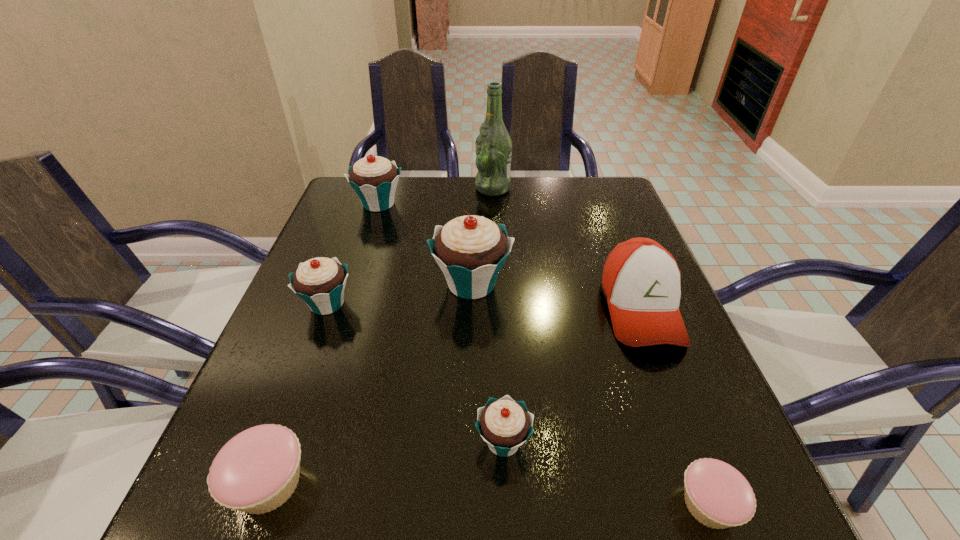
Locate an element on the screen. free spot between the third shortest cupcake and the orange baseball cap is located at coordinates (572, 375).

In order to click on vacant space that's between the nearest teal cupcake and the green beer bottle in this screenshot , I will do `click(498, 315)`.

This screenshot has width=960, height=540. In order to click on vacant area that lies between the seventh tallest object and the rightmost cupcake in this screenshot , I will do `click(489, 494)`.

Where is `empty location between the fifth tallest cupcake and the seventh shortest object`? empty location between the fifth tallest cupcake and the seventh shortest object is located at coordinates (370, 383).

Find the location of a particular element. This screenshot has width=960, height=540. vacant space that's between the fifth tallest cupcake and the fifth shortest cupcake is located at coordinates (324, 343).

Image resolution: width=960 pixels, height=540 pixels. In order to click on empty space between the sixth tallest object and the second tallest object in this screenshot , I will do `click(488, 363)`.

This screenshot has height=540, width=960. Identify the location of object identified as the second closest to the tallest cupcake. (641, 280).

Point out which object is positioned as the seventh nearest to the tallest cupcake. Please provide its 2D coordinates. Your answer should be formatted as a tuple, i.e. [(x, y)], where the tuple contains the x and y coordinates of a point satisfying the conditions above.

[(718, 496)]

Locate which cupcake ranks third in proximity to the second shortest object. Please provide its 2D coordinates. Your answer should be formatted as a tuple, i.e. [(x, y)], where the tuple contains the x and y coordinates of a point satisfying the conditions above.

[(470, 250)]

At what (x,y) coordinates should I click in order to perform the action: click on cupcake that is the fifth closest to the baseball cap. Please return your answer as a coordinate pair (x, y). Looking at the image, I should click on (320, 282).